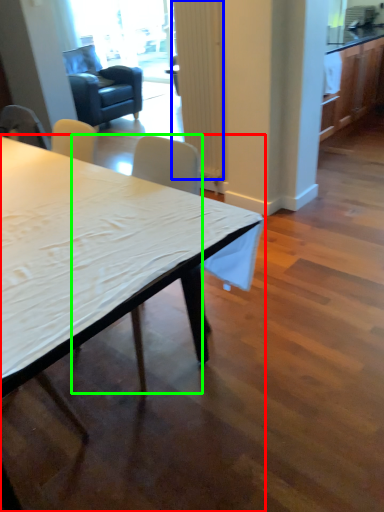
Question: Based on their relative distances, which object is farther from desk (highlighted by a red box)? Choose from curtain (highlighted by a blue box) and chair (highlighted by a green box).

Choices:
 (A) curtain
 (B) chair

Answer: (A)